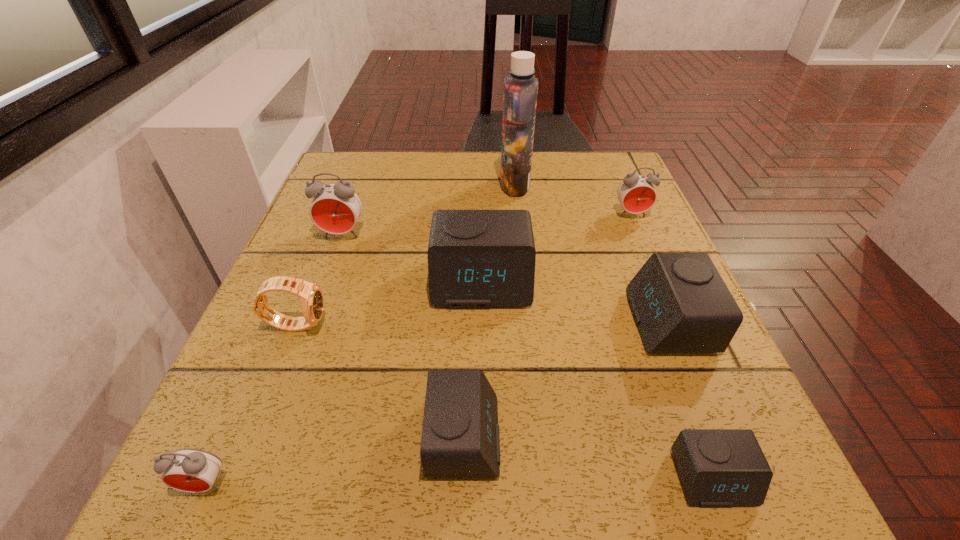
At what (x,y) coordinates should I click in order to perform the action: click on blank space located 0.060m on the front-facing side of the third smallest black alarm clock. Please return your answer as a coordinate pair (x, y). Looking at the image, I should click on (599, 321).

The height and width of the screenshot is (540, 960). Identify the location of free region located on the front-facing side of the third smallest black alarm clock. (511, 321).

Find the location of a particular element. vacant space located 0.160m on the front-facing side of the third smallest black alarm clock is located at coordinates (540, 321).

Image resolution: width=960 pixels, height=540 pixels. Identify the location of vacant area situated on the front-facing side of the third biggest black alarm clock. [550, 436].

In order to click on object at the far edge in this screenshot , I will do `click(520, 87)`.

Locate an element on the screen. The image size is (960, 540). watch at the left edge is located at coordinates (311, 296).

Identify the location of object situated at the near left corner. (191, 470).

This screenshot has height=540, width=960. In order to click on object that is at the near right corner in this screenshot , I will do `click(718, 467)`.

The width and height of the screenshot is (960, 540). I want to click on free space at the far edge of the desktop, so click(422, 172).

At what (x,y) coordinates should I click in order to perform the action: click on free point at the near edge. Please return your answer as a coordinate pair (x, y). The width and height of the screenshot is (960, 540). Looking at the image, I should click on (652, 498).